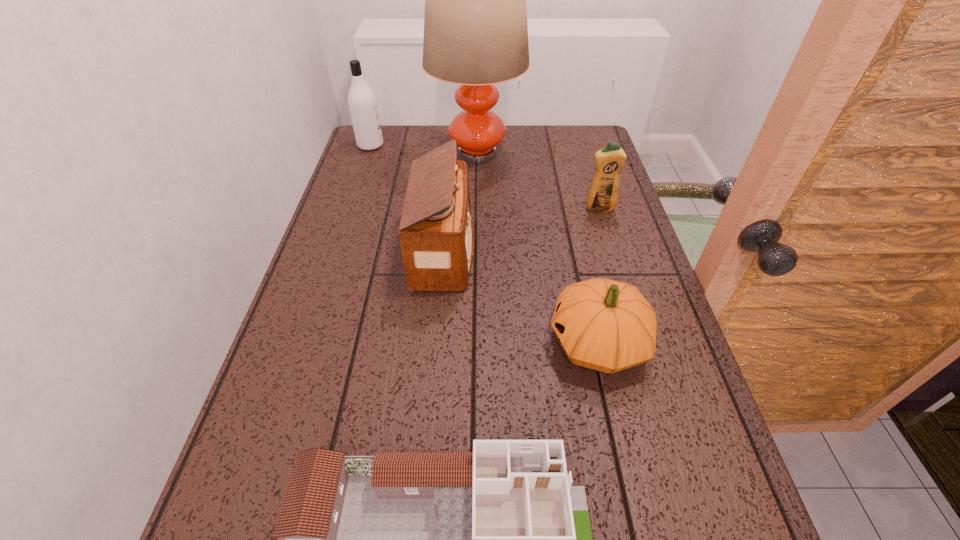
I want to click on free space located on the side of the second nearest object with the carved face, so click(x=428, y=343).

Identify the location of free location located on the side of the second nearest object with the carved face. This screenshot has height=540, width=960. (475, 343).

Find the location of a particular element. This screenshot has height=540, width=960. blank space located on the side of the second nearest object with the carved face is located at coordinates (428, 343).

Locate an element on the screen. This screenshot has width=960, height=540. lamp at the far edge is located at coordinates (475, 26).

This screenshot has width=960, height=540. What are the coordinates of `shampoo present at the far edge` in the screenshot? It's located at (362, 103).

You are a GUI agent. You are given a task and a screenshot of the screen. Output one action in this format:
    pyautogui.click(x=<x>, y=<y>)
    Task: Click on the object that is positioned at the left edge
    The width and height of the screenshot is (960, 540).
    Given the screenshot: What is the action you would take?
    pyautogui.click(x=362, y=103)

I want to click on detergent that is at the right edge, so point(603,195).

Locate an element on the screen. gourd that is at the right edge is located at coordinates (605, 325).

Locate an element on the screen. The width and height of the screenshot is (960, 540). object that is positioned at the far left corner is located at coordinates (362, 103).

Identify the location of free space at the far edge. The width and height of the screenshot is (960, 540). (512, 142).